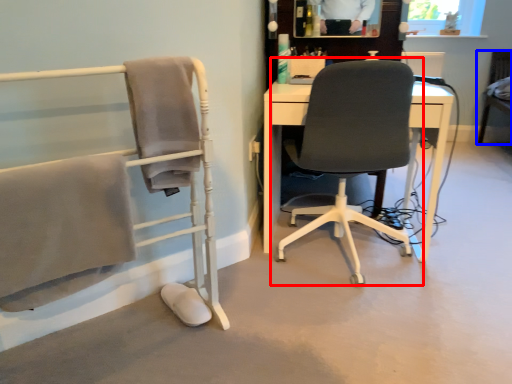
Question: Which object is closer to the camera taking this photo, chair (highlighted by a red box) or chair (highlighted by a blue box)?

Choices:
 (A) chair
 (B) chair

Answer: (A)